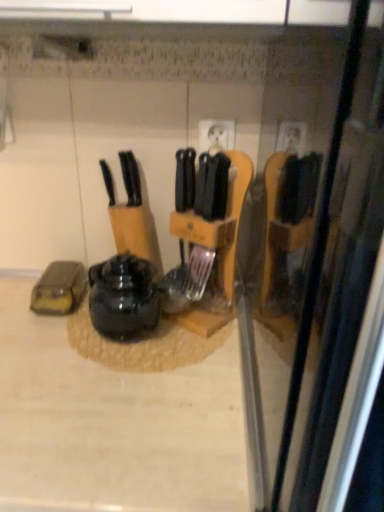
Identify the location of free space in front of shiny black kettle at center. The height and width of the screenshot is (512, 384). (109, 392).